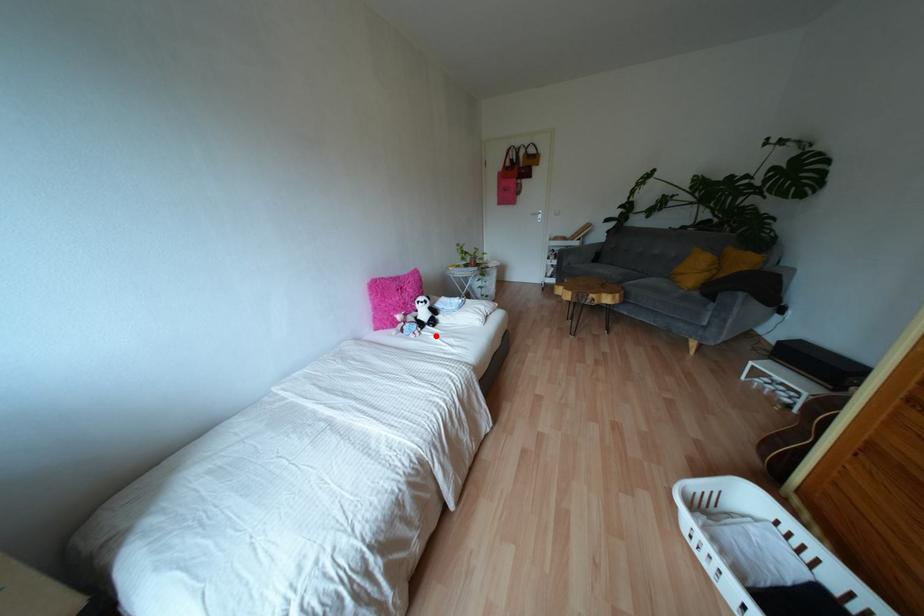
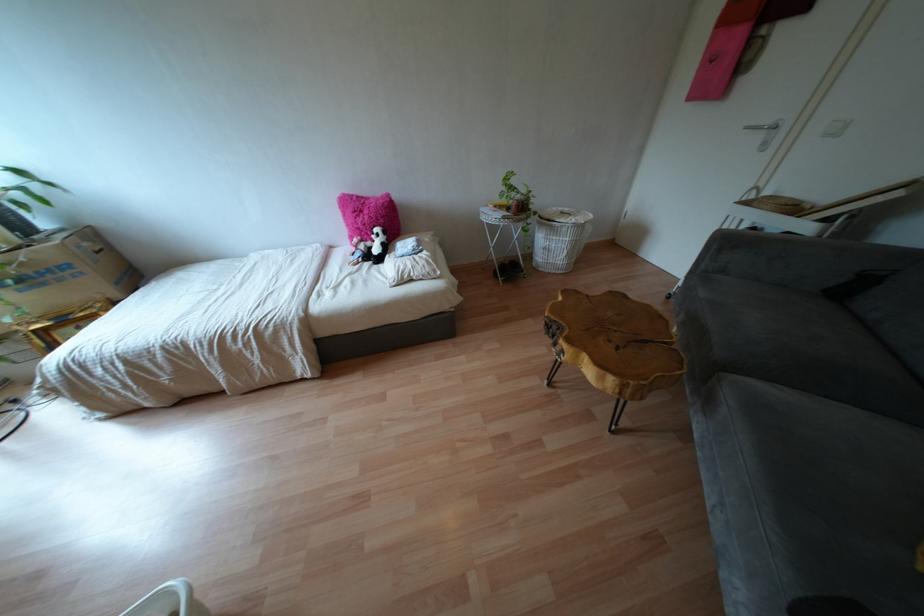
Find the pixel in the second image that matches the highlighted location in the first image.

(349, 274)